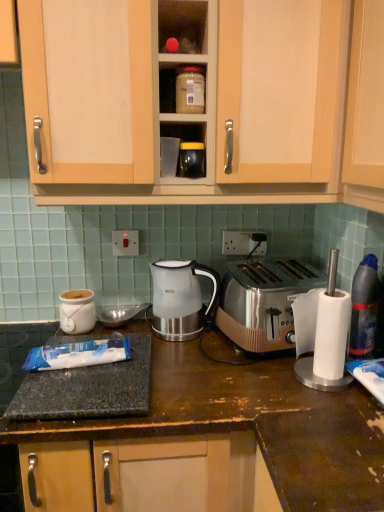
Identify the location of free space above granite dark brown at lower left (from a real-world perspective). (114, 369).